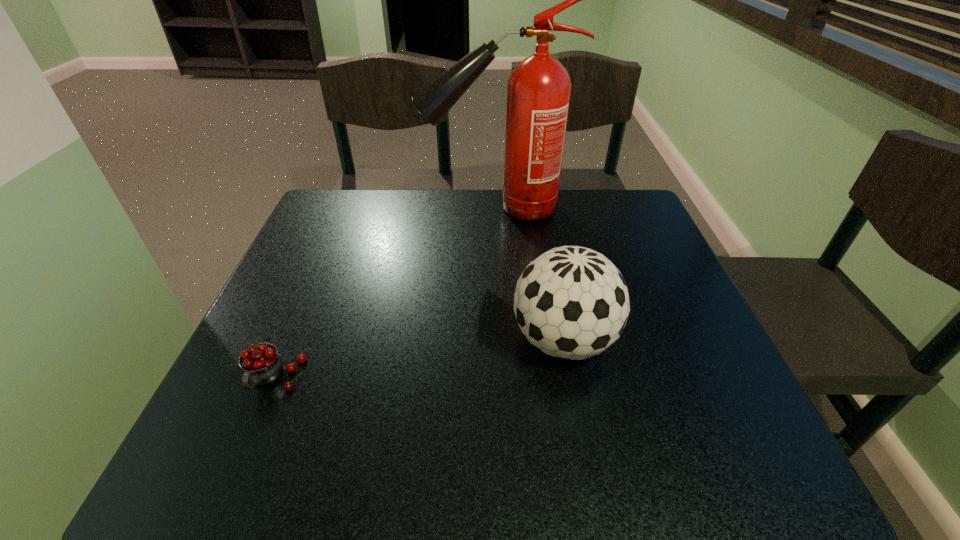
You are a GUI agent. You are given a task and a screenshot of the screen. Output one action in this format:
    pyautogui.click(x=<x>, y=<y>)
    Task: Click on the empty space between the cherry and the farthest object
    The image size is (960, 540).
    Given the screenshot: What is the action you would take?
    pyautogui.click(x=385, y=293)

Where is `vacant area that lies between the soccer ball and the cherry`? This screenshot has width=960, height=540. vacant area that lies between the soccer ball and the cherry is located at coordinates (419, 360).

I want to click on free space between the shortest object and the tallest object, so click(385, 293).

Where is `empty space between the shortest object and the fire extinguisher`? This screenshot has width=960, height=540. empty space between the shortest object and the fire extinguisher is located at coordinates (385, 293).

The height and width of the screenshot is (540, 960). I want to click on free area in between the tallest object and the shortest object, so click(x=385, y=293).

I want to click on free space that is in between the fire extinguisher and the leftmost object, so click(x=385, y=293).

Identify the location of the second closest object relative to the tallest object. The height and width of the screenshot is (540, 960). (262, 364).

At what (x,y) coordinates should I click in order to perform the action: click on object identified as the second closest to the soccer ball. Please return your answer as a coordinate pair (x, y). The image size is (960, 540). Looking at the image, I should click on (262, 364).

You are a GUI agent. You are given a task and a screenshot of the screen. Output one action in this format:
    pyautogui.click(x=<x>, y=<y>)
    Task: Click on the vacant region that satisfies the following two spatial constraints: 1. at the nozzle end of the farthest object; 2. on the right side of the second tallest object
    
    Given the screenshot: What is the action you would take?
    pyautogui.click(x=502, y=341)

The height and width of the screenshot is (540, 960). Find the location of `vacant space that satisfies the following two spatial constraints: 1. at the nozzle end of the tallest object; 2. on the right side of the soccer ball`. vacant space that satisfies the following two spatial constraints: 1. at the nozzle end of the tallest object; 2. on the right side of the soccer ball is located at coordinates (502, 341).